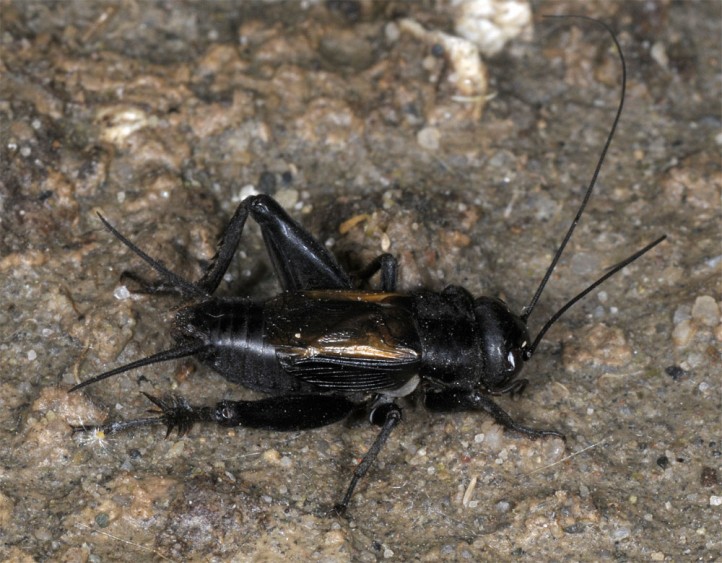
At what (x,y) coordinates should I click in order to perform the action: click on right front leg. Please return your answer as a coordinate pair (x, y). Looking at the image, I should click on (500, 417).